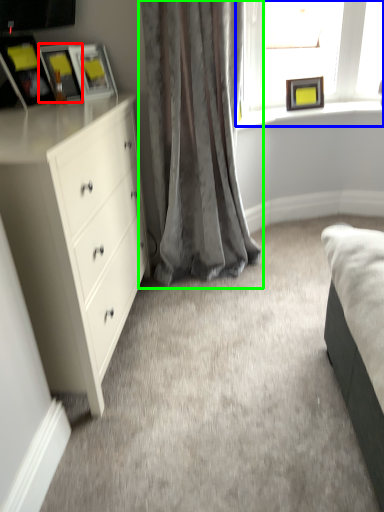
Question: Which is farther away from picture frame (highlighted by a red box)? window (highlighted by a blue box) or curtain (highlighted by a green box)?

Choices:
 (A) window
 (B) curtain

Answer: (A)